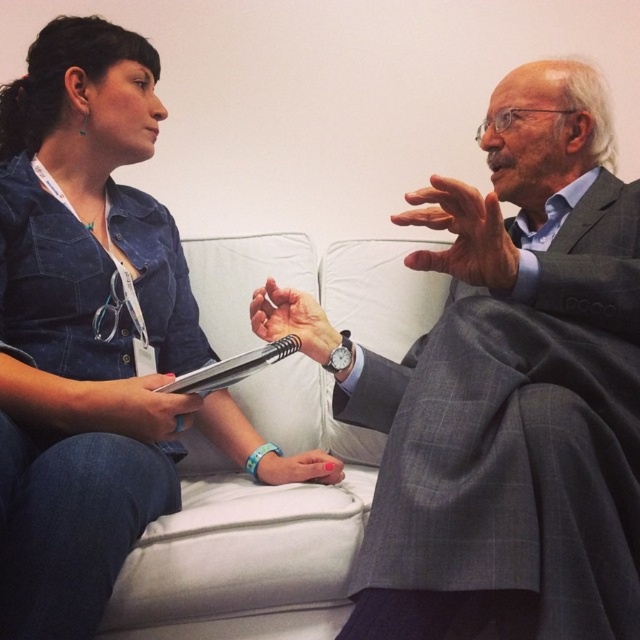
You are organizing a charity event and need to decide which garment to donate based on size. Given the gray checkered suit at center and the denim jacket at upper left, which one would you choose if you prefer donating larger items?

The gray checkered suit at center is larger in size than the denim jacket at upper left, so you should choose the gray checkered suit at center for donation.

You are organizing a photo shoot and need to place a 1.2 meter wide backdrop between the gray checkered suit at center and the denim jacket at upper left. Will the backdrop fit between them?

The gray checkered suit at center is wider than the denim jacket at upper left. Since the backdrop is 1.2 meters wide, it depends on the actual distance between them. However, the description only mentions their widths, not the space between. Without knowing the distance between the two objects, we cannot determine if the backdrop will fit.

You are an event planner organizing seating for a panel discussion. You need to place two chairs for the gray checkered suit at center and the denim jacket at upper left. According to the image, which chair should be placed to the right side?

The gray checkered suit at center should be placed to the right side of the denim jacket at upper left because the gray checkered suit at center is positioned on the right side of denim jacket at upper left in the image.